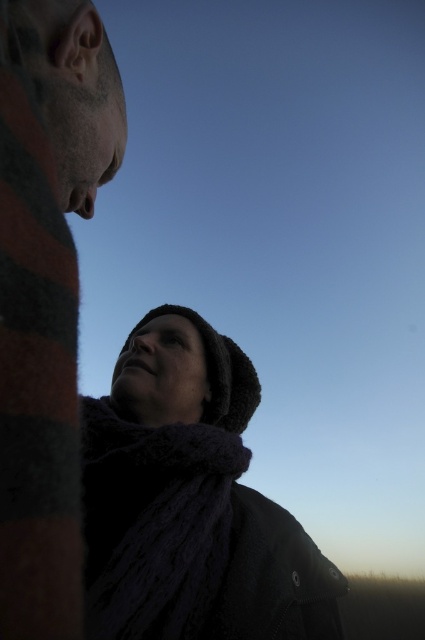
You are a tailor measuring scarves for a display. You have two scarves in front of you, the knitted wool scarf at lower left and the dark woolen scarf at lower center. The display requires that the distance between them must be at least 5 centimeters. Based on the image, will their current placement meet the requirement?

The distance between the knitted wool scarf at lower left and the dark woolen scarf at lower center is 4.53 centimeters, which is less than the required 5 centimeters. Therefore, their current placement does not meet the requirement.

You are standing at the center of the image. Which direction should you move to get closer to the knitted wool scarf at lower left?

You should move to the lower left direction to get closer to the knitted wool scarf at lower left.

You are a photographer trying to capture a close shot of both the knitted wool scarf at lower left and the striped wool scarf at left in the scene. Given that your camera has a maximum focus range of 60 centimeters, will you be able to include both scarves in the same frame without moving the camera?

The knitted wool scarf at lower left is 67.36 centimeters from the striped wool scarf at left, which exceeds the camera maximum focus range of 60 centimeters. Therefore, you won not be able to include both scarves in the same frame without moving the camera.